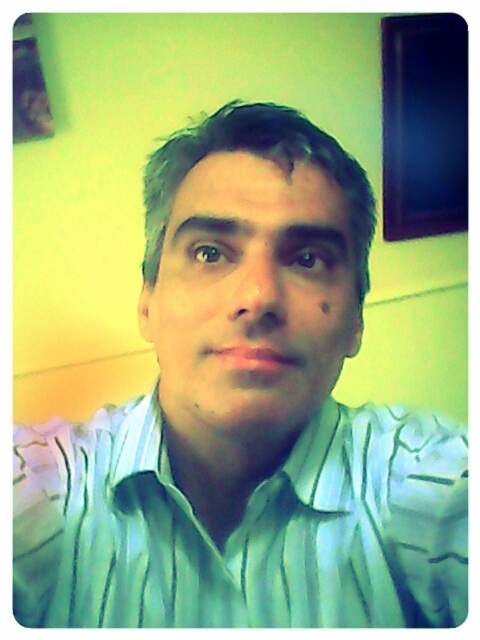
Question: Can you confirm if green striped dress shirt at center is positioned to the left of matte green shirt at center?

Choices:
 (A) no
 (B) yes

Answer: (A)

Question: Which point appears farthest from the camera in this image?

Choices:
 (A) (345, 234)
 (B) (261, 582)

Answer: (B)

Question: Which point is closer to the camera taking this photo?

Choices:
 (A) (186, 358)
 (B) (17, 435)

Answer: (A)

Question: Is green striped dress shirt at center in front of matte green shirt at center?

Choices:
 (A) no
 (B) yes

Answer: (A)

Question: Is green striped dress shirt at center closer to the viewer compared to matte green shirt at center?

Choices:
 (A) yes
 (B) no

Answer: (B)

Question: Which point appears farthest from the camera in this image?

Choices:
 (A) (441, 595)
 (B) (288, 216)

Answer: (A)